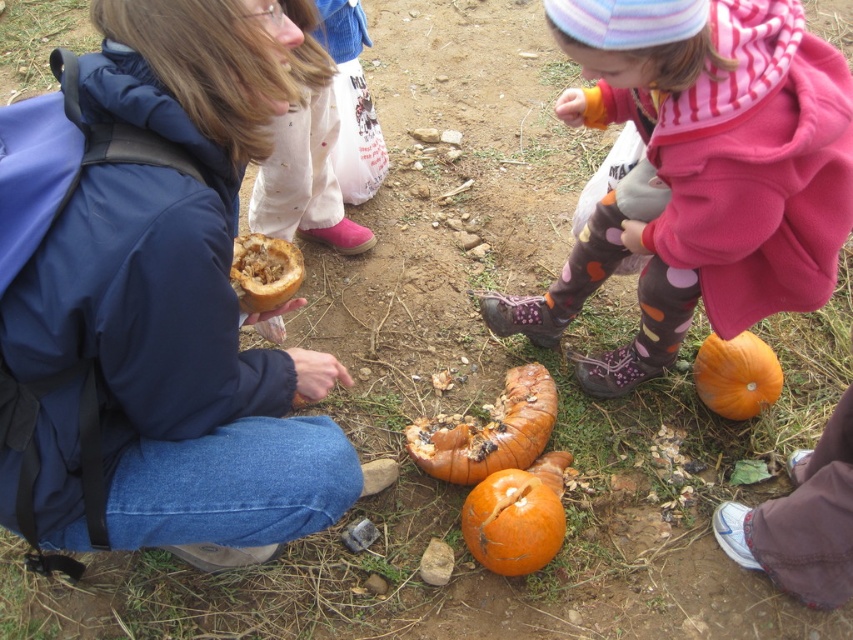
Question: Does matte brown pumpkin at center lie in front of polka dot leggings at lower center?

Choices:
 (A) yes
 (B) no

Answer: (A)

Question: Which object is positioned closest to the matte brown pumpkin at center?

Choices:
 (A) orange matte pumpkin at lower right
 (B) polka dot leggings at lower center

Answer: (B)

Question: Is orange rough pumpkin at center positioned before brown fibrous pumpkin at center?

Choices:
 (A) yes
 (B) no

Answer: (B)

Question: Among these objects, which one is farthest from the camera?

Choices:
 (A) orange rough pumpkin at center
 (B) matte brown pumpkin at center

Answer: (A)

Question: In this image, where is matte brown pumpkin at center located relative to polka dot leggings at lower center?

Choices:
 (A) right
 (B) left

Answer: (B)

Question: Estimate the real-world distances between objects in this image. Which object is closer to the orange rough pumpkin at center?

Choices:
 (A) brown fibrous pumpkin at center
 (B) rotten pumpkin at center
 (C) polka dot leggings at lower center
 (D) matte brown pumpkin at center

Answer: (B)